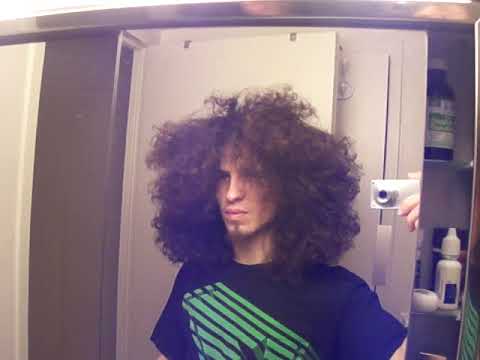
Find the location of a particular element. mirror is located at coordinates (403, 109).